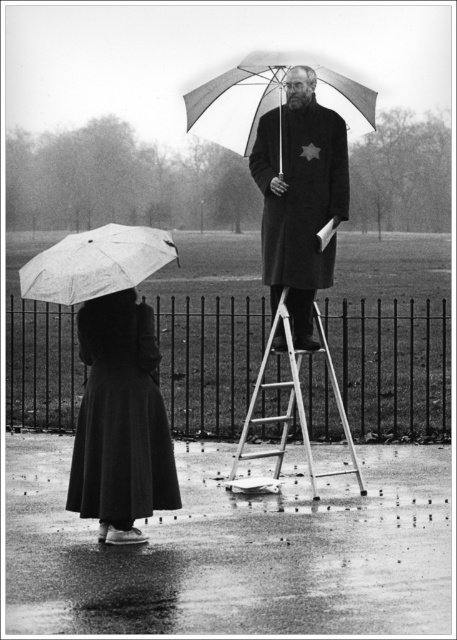
In the scene shown: You are standing in the park and see the metallic wire fence at center. Can you estimate its position relative to the ladder and the person standing on it?

The metallic wire fence at center is located at point [392,368], which is to the right of the ladder and the person standing on it.

You are a photographer trying to capture a clear shot of the metallic wire fence at center and the transparent plastic umbrella at lower left. Since the scene is overcast, you want to ensure both objects are visible in your photo. Given their sizes, which object might you need to position closer to the camera to ensure it isn

The metallic wire fence at center is taller than the transparent plastic umbrella at lower left. To ensure both are visible, you should position the transparent plastic umbrella at lower left closer to the camera since it is smaller and might get lost in the background if placed farther away.